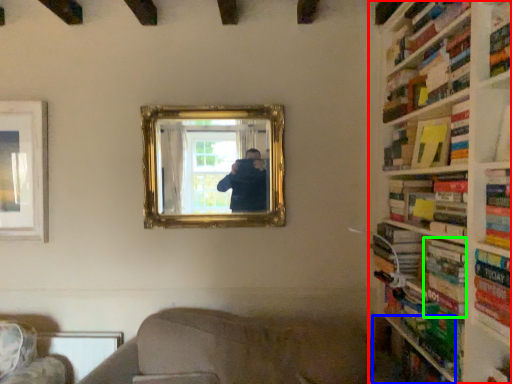
Question: Which object is positioned farthest from bookcase (highlighted by a red box)? Select from shelf (highlighted by a blue box) and book (highlighted by a green box).

Choices:
 (A) shelf
 (B) book

Answer: (A)